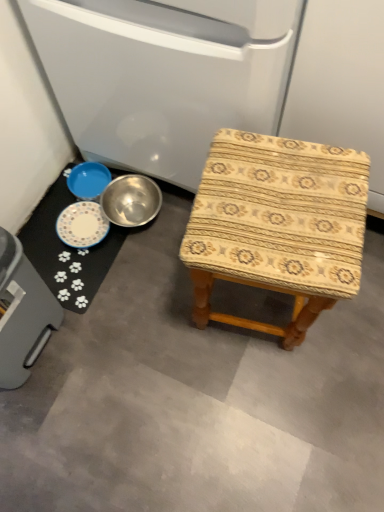
The image size is (384, 512). I want to click on free space in front of blue metallic bowl at lower left, so click(x=70, y=251).